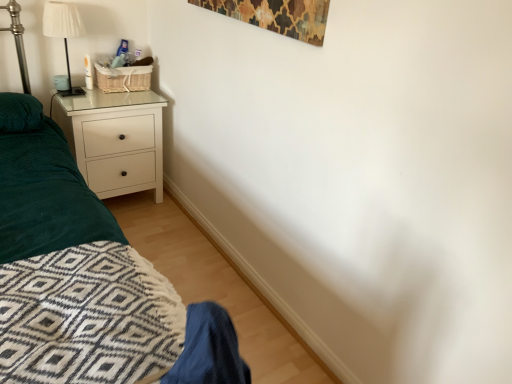
Question: Is white glossy chest of drawers at left inside or outside of white pleated fabric lampshade at upper left?

Choices:
 (A) outside
 (B) inside

Answer: (A)

Question: From the image's perspective, is white glossy chest of drawers at left above or below white pleated fabric lampshade at upper left?

Choices:
 (A) above
 (B) below

Answer: (B)

Question: Is point (147, 185) closer or farther from the camera than point (66, 92)?

Choices:
 (A) closer
 (B) farther

Answer: (B)

Question: From the image's perspective, is white pleated fabric lampshade at upper left positioned above or below white glossy chest of drawers at left?

Choices:
 (A) below
 (B) above

Answer: (B)

Question: From a real-world perspective, is white pleated fabric lampshade at upper left positioned above or below white glossy chest of drawers at left?

Choices:
 (A) above
 (B) below

Answer: (A)

Question: Is white pleated fabric lampshade at upper left to the left or to the right of white glossy chest of drawers at left in the image?

Choices:
 (A) right
 (B) left

Answer: (B)

Question: From their relative heights in the image, would you say white pleated fabric lampshade at upper left is taller or shorter than white glossy chest of drawers at left?

Choices:
 (A) short
 (B) tall

Answer: (A)